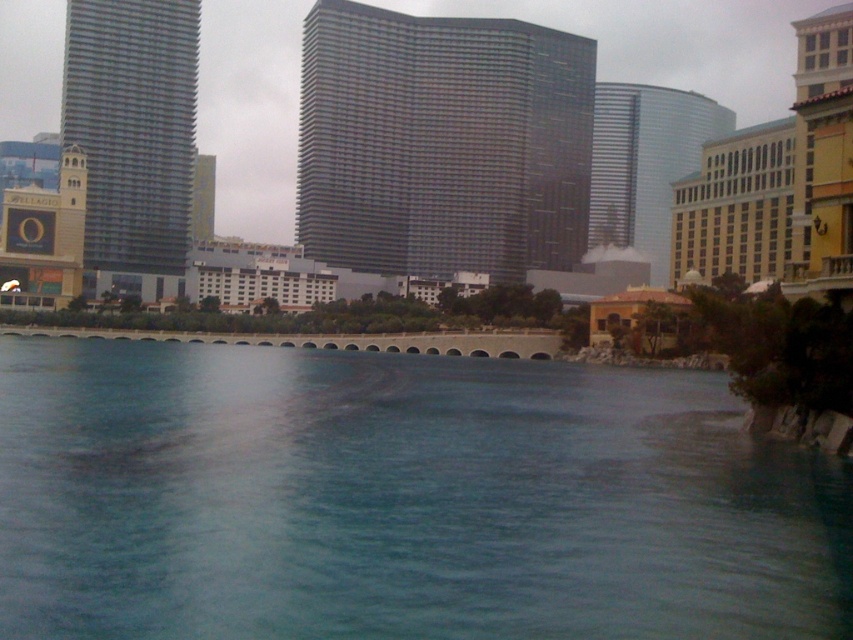
You are a drone operator tasked with flying a drone that has a maximum flight distance of 35 meters. You need to fly from the glassy metallic skyscraper at center to the glassy reflective skyscraper at center. Can your drone complete this flight without needing to recharge?

The glassy metallic skyscraper at center is 36.88 meters from the glassy reflective skyscraper at center. Since the distance exceeds the drone operator maximum flight distance of 35 meters, the drone will not be able to complete the flight without recharging.

You are standing at the edge of the waterfront scene and want to locate the blue glassy water at center. According to the coordinates provided, where exactly is it positioned?

The blue glassy water at center is positioned at coordinates point (399,500).